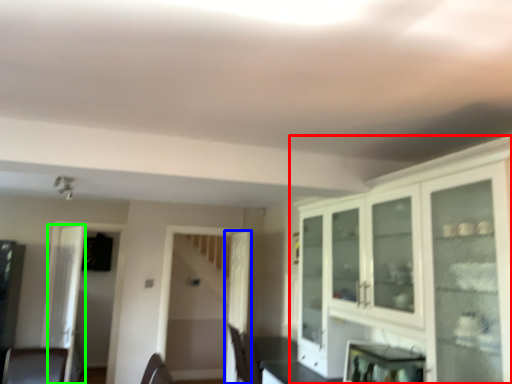
Question: Which is farther away from cabinetry (highlighted by a red box)? door (highlighted by a blue box) or glass door (highlighted by a green box)?

Choices:
 (A) door
 (B) glass door

Answer: (B)